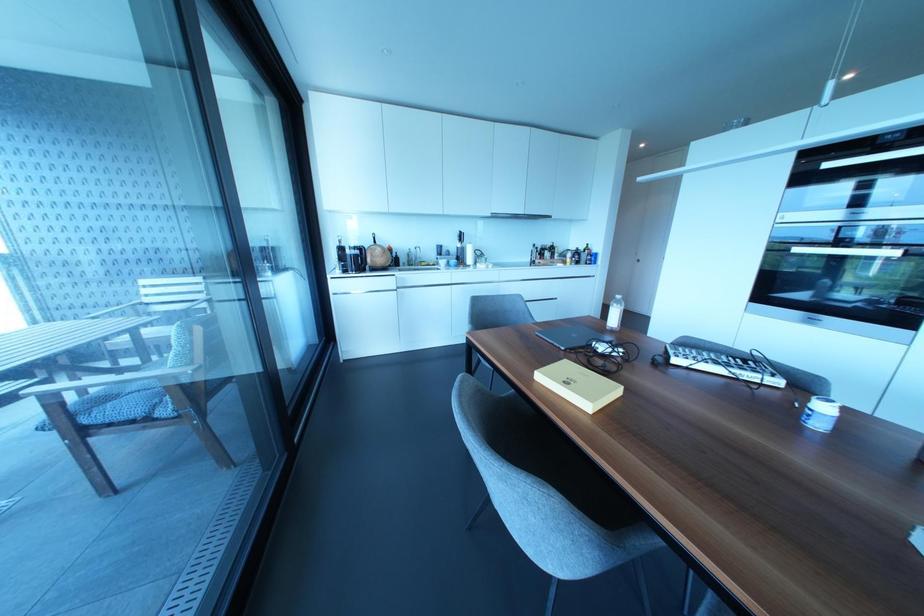
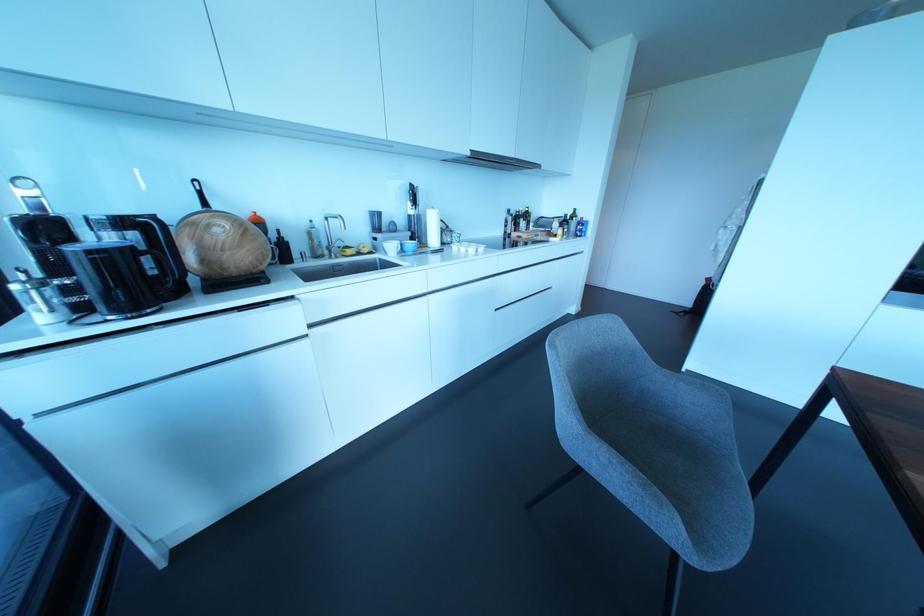
In the second image, find the point that corresponds to point (457, 245) in the first image.

(410, 211)